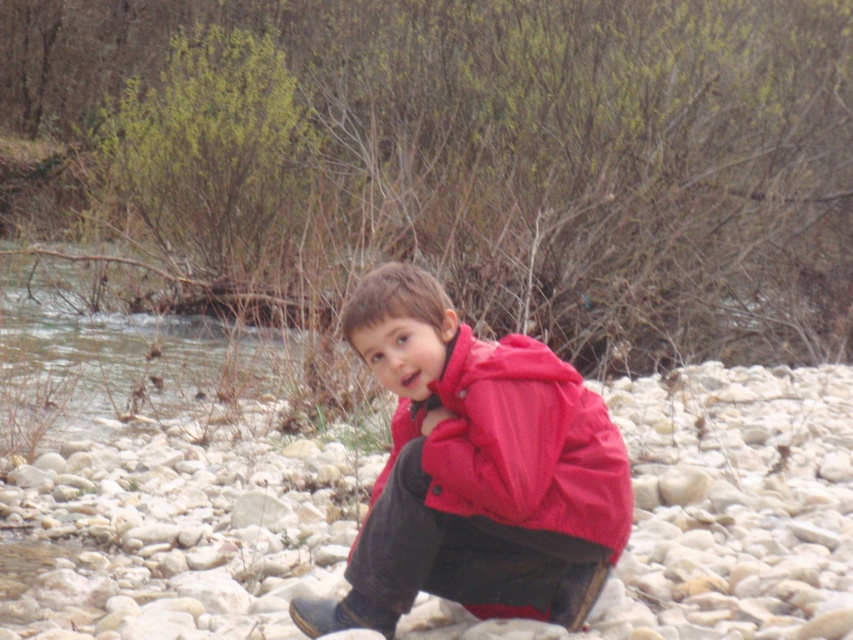
Is point (694, 560) more distant than point (582, 538)?

Yes, it is.

Is the position of smooth pebbles at center less distant than that of matte red jacket at center?

That is False.

Between point (759, 516) and point (415, 515), which one is positioned in front?

Point (415, 515) is in front.

I want to click on smooth pebbles at center, so click(717, 513).